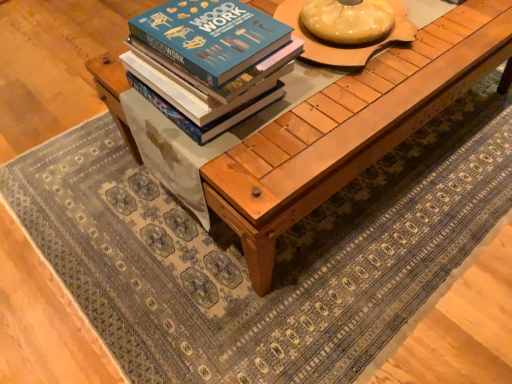
At what (x,y) coordinates should I click in order to perform the action: click on space that is in front of matte wooden round table at center. Please return your answer as a coordinate pair (x, y). Looking at the image, I should click on (345, 105).